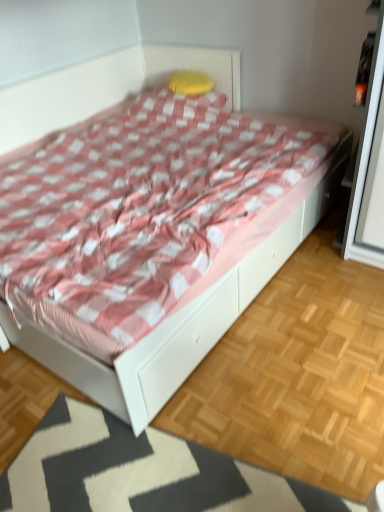
Question: From a real-world perspective, is white glossy bed at center physically above white textured mat at lower center?

Choices:
 (A) no
 (B) yes

Answer: (B)

Question: Considering the relative positions of white glossy bed at center and white textured mat at lower center in the image provided, is white glossy bed at center to the right of white textured mat at lower center from the viewer's perspective?

Choices:
 (A) yes
 (B) no

Answer: (B)

Question: Is white textured mat at lower center a part of white glossy bed at center?

Choices:
 (A) no
 (B) yes

Answer: (A)

Question: Is white glossy bed at center directly adjacent to white textured mat at lower center?

Choices:
 (A) yes
 (B) no

Answer: (B)

Question: Is white textured mat at lower center at the back of white glossy bed at center?

Choices:
 (A) no
 (B) yes

Answer: (A)

Question: Could you tell me if white glossy bed at center is facing white textured mat at lower center?

Choices:
 (A) no
 (B) yes

Answer: (A)

Question: From the image's perspective, is white textured mat at lower center under white glossy bed at center?

Choices:
 (A) no
 (B) yes

Answer: (B)

Question: Considering the relative positions of white textured mat at lower center and white glossy bed at center in the image provided, is white textured mat at lower center behind white glossy bed at center?

Choices:
 (A) yes
 (B) no

Answer: (B)

Question: From a real-world perspective, is white textured mat at lower center physically below white glossy bed at center?

Choices:
 (A) yes
 (B) no

Answer: (A)

Question: From a real-world perspective, is white textured mat at lower center positioned over white glossy bed at center based on gravity?

Choices:
 (A) no
 (B) yes

Answer: (A)

Question: Is white textured mat at lower center to the left of white glossy bed at center from the viewer's perspective?

Choices:
 (A) yes
 (B) no

Answer: (B)

Question: From the image's perspective, is white textured mat at lower center located above white glossy bed at center?

Choices:
 (A) no
 (B) yes

Answer: (A)

Question: Are yellow fabric pillow at upper center and white glossy bed at center beside each other?

Choices:
 (A) no
 (B) yes

Answer: (A)